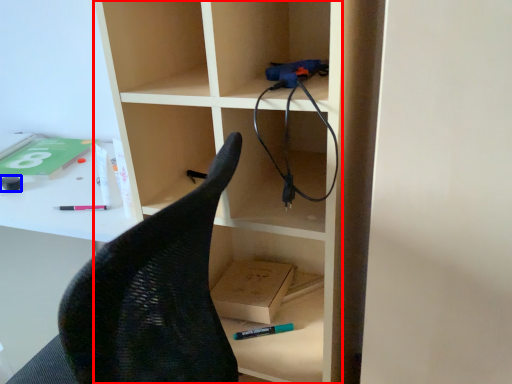
Question: Which object is closer to the camera taking this photo, bookshelf (highlighted by a red box) or stationery (highlighted by a blue box)?

Choices:
 (A) bookshelf
 (B) stationery

Answer: (A)